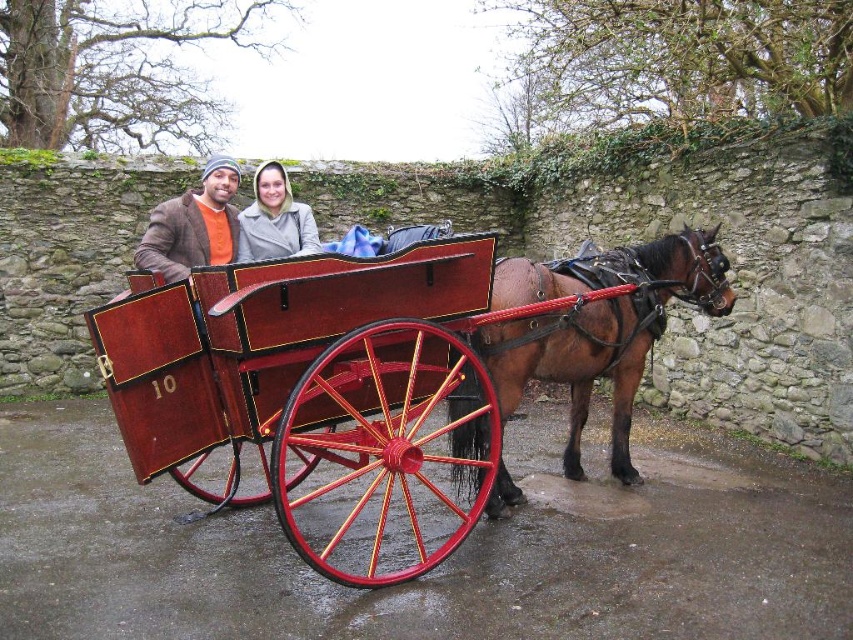
Which is more to the right, matte brown coat at center or matte gray hoodie at center?

Positioned to the right is matte gray hoodie at center.

Does point (248, 237) lie in front of point (286, 216)?

Yes.

Identify the location of matte brown coat at center. Image resolution: width=853 pixels, height=640 pixels. (196, 227).

Between shiny wood cart at center and matte gray hoodie at center, which one is positioned higher?

Positioned higher is matte gray hoodie at center.

Between shiny wood cart at center and matte gray hoodie at center, which one has less height?

Standing shorter between the two is matte gray hoodie at center.

What do you see at coordinates (320, 392) in the screenshot?
I see `shiny wood cart at center` at bounding box center [320, 392].

Find the location of a particular element. shiny wood cart at center is located at coordinates (320, 392).

Can you confirm if brown glossy horse at center is shorter than matte gray hoodie at center?

No, brown glossy horse at center is not shorter than matte gray hoodie at center.

Who is more forward, (635,330) or (262,234)?

Point (262,234) is in front.

Which is in front, point (479, 451) or point (271, 257)?

Point (479, 451) is in front.

Where is `brown glossy horse at center`? This screenshot has width=853, height=640. brown glossy horse at center is located at coordinates [x=596, y=326].